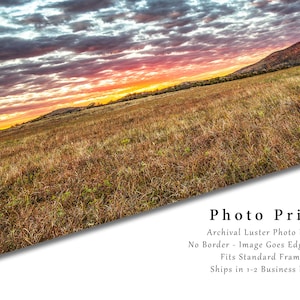
Locate an element on the screen. The width and height of the screenshot is (300, 300). empty space below photo is located at coordinates (116, 247).